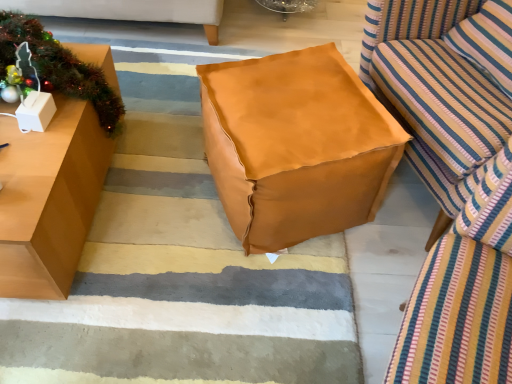
You are a GUI agent. You are given a task and a screenshot of the screen. Output one action in this format:
    pyautogui.click(x=<x>, y=<y>)
    Task: Click on the vacant area that is situated to the right of white cardboard box at left
    The image size is (512, 384).
    Given the screenshot: What is the action you would take?
    click(x=64, y=123)